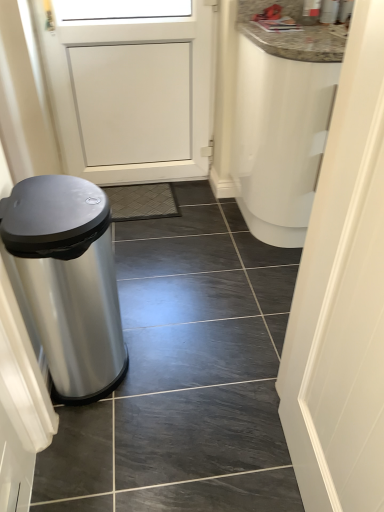
At what (x,y) coordinates should I click in order to perform the action: click on free space above polished stainless steel trash can at left (from a real-world perspective). Please return your answer as a coordinate pair (x, y). Looking at the image, I should click on (52, 207).